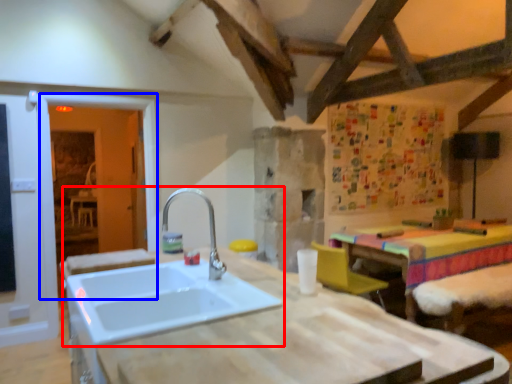
Question: Which point is further to the camera, sink (highlighted by a red box) or glass door (highlighted by a blue box)?

Choices:
 (A) sink
 (B) glass door

Answer: (B)